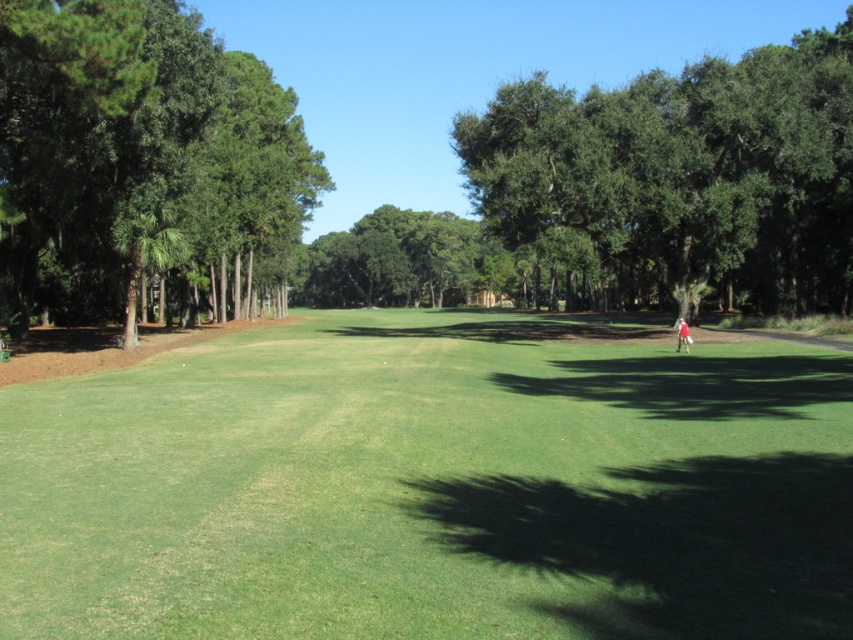
Question: Among these objects, which one is nearest to the camera?

Choices:
 (A) green leafy tree at left
 (B) green leafy tree at center
 (C) red fabric golfer at center

Answer: (A)

Question: Which object is positioned closest to the green leafy tree at center?

Choices:
 (A) green leafy tree at left
 (B) green leafy tree at right
 (C) red fabric golfer at center
 (D) green grass at center

Answer: (B)

Question: Is green grass at center smaller than green leafy tree at center?

Choices:
 (A) yes
 (B) no

Answer: (A)

Question: Is green leafy tree at right to the right of green leafy tree at center from the viewer's perspective?

Choices:
 (A) no
 (B) yes

Answer: (B)

Question: Which object is positioned farthest from the green leafy tree at center?

Choices:
 (A) green leafy tree at left
 (B) red fabric golfer at center
 (C) green leafy tree at right
 (D) green grass at center

Answer: (D)

Question: Does green leafy tree at right appear on the left side of green leafy tree at left?

Choices:
 (A) yes
 (B) no

Answer: (B)